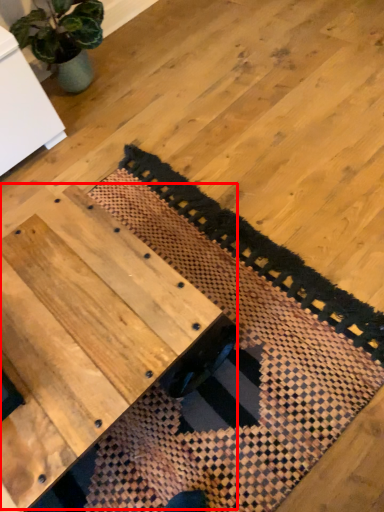
Question: From the image, what is the correct spatial relationship of table (annotated by the red box) in relation to mat?

Choices:
 (A) right
 (B) left

Answer: (B)